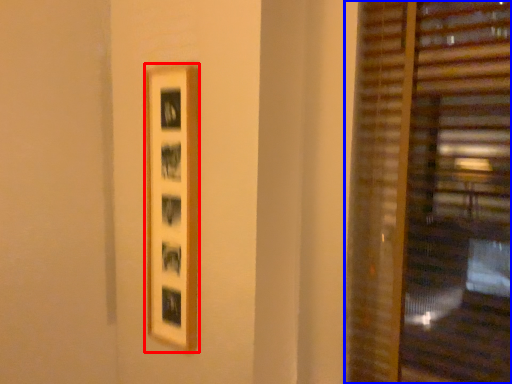
Question: Which of the following is the closest to the observer, picture frame (highlighted by a red box) or window blind (highlighted by a blue box)?

Choices:
 (A) picture frame
 (B) window blind

Answer: (B)